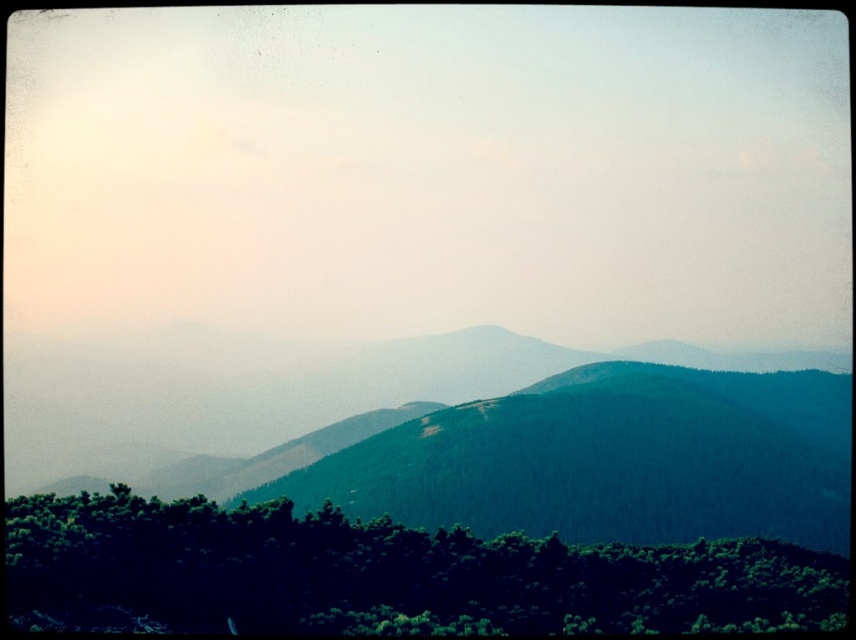
You are a hiker standing at the base of the mountains. You see the green forested mountain at center and the green leafy trees at lower center. Which one is closer to you?

The green leafy trees at lower center are closer to you because they are positioned behind the green forested mountain at center, meaning the mountain is in front of them.

You are a hiker planning to traverse from the green leafy trees at lower center to the green forested mountain at center. Given that your average walking pace is 1.5 meters per second, how long will it take you to reach the mountain?

The distance between the green forested mountain at center and the green leafy trees at lower center is 105.93 meters. At a pace of 1.5 meters per second, the time required would be approximately 70.62 seconds, which is roughly 1 minute and 11 seconds.

You are a hiker standing at the base of the green forested mountain at center. You want to reach the summit. If your average walking speed is 3 km per hour, how long would it take you to reach the summit considering the distance provided?

The distance between the green forested mountain at center and the camera is 68.18 meters. Since you are at the base, this distance likely represents the horizontal distance to the summit. At a walking speed of 3 km per hour, converting meters to kilometers gives 0.06818 km. Dividing distance by speed yields 0.06818 km divided by 3 km per hour equals approximately 0.0227 hours, which converts to roughly 1.36 minutes. However, this calculation assumes a direct path and flat terrain, which may not account for